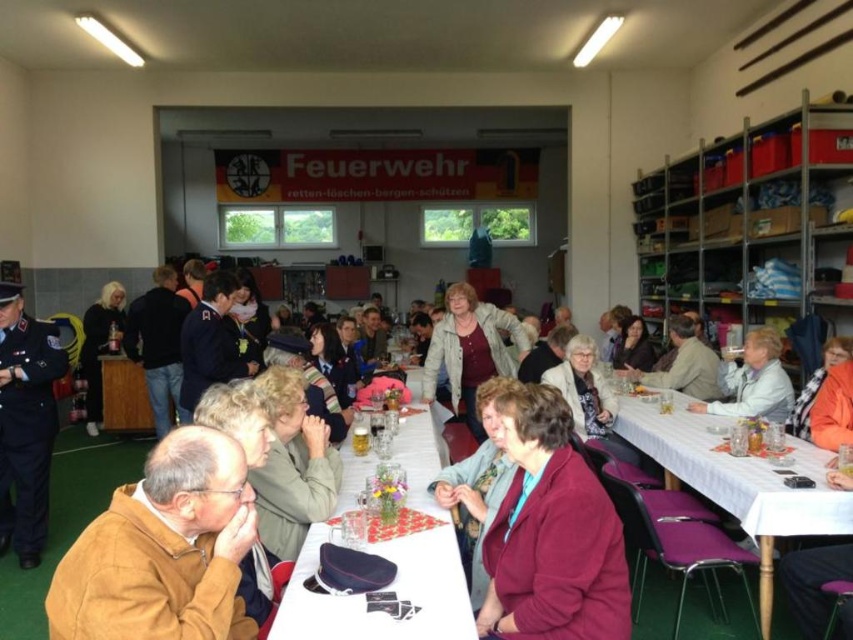
Question: Can you confirm if green fabric jacket at center is positioned to the left of light beige jacket at center?

Choices:
 (A) yes
 (B) no

Answer: (A)

Question: Is black cotton shirt at left positioned behind matte brown jacket at center?

Choices:
 (A) yes
 (B) no

Answer: (A)

Question: Is the position of white plastic table at lower right less distant than that of light beige jacket at center?

Choices:
 (A) yes
 (B) no

Answer: (A)

Question: Which point is closer to the camera?

Choices:
 (A) brown leather jacket at lower left
 (B) white fabric jacket at right
 (C) maroon fabric coat at lower center
 (D) white plastic table at center

Answer: (A)

Question: Which is nearer to the brown leather jacket at lower left?

Choices:
 (A) light beige jacket at center
 (B) matte brown jacket at center

Answer: (A)

Question: Which point is farther to the camera?

Choices:
 (A) light beige jacket at center
 (B) brown leather jacket at lower left

Answer: (A)